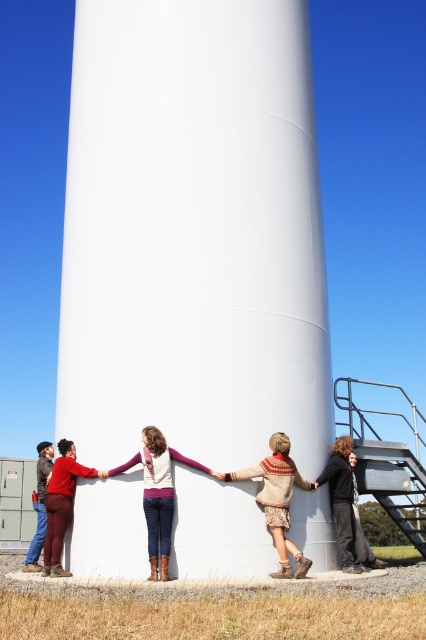
You are a photographer trying to capture a photo of the white smooth water tower at center and the knitted sweater at center. Since you want both objects to appear equally prominent in the photo, which object should you move closer to, and which should you move farther away?

Since the white smooth water tower at center is larger than the knitted sweater at center, you should move closer to the knitted sweater at center and move farther away from the white smooth water tower at center to make them appear equally prominent in the photo.

You are a photographer trying to capture a photo of the white smooth water tower at center and the matte purple sweater at center. Which object should you focus on first if you want to ensure both are in frame without moving the camera?

You should focus on the white smooth water tower at center first because it is taller than the matte purple sweater at center, so it will require adjusting the camera angle to include its full height while keeping the sweater in view.